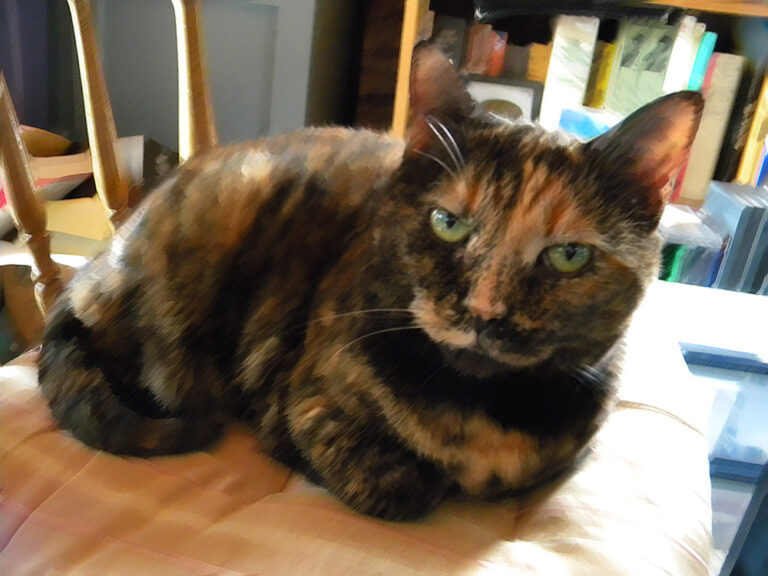
Where is `books`? This screenshot has width=768, height=576. books is located at coordinates (739, 200).